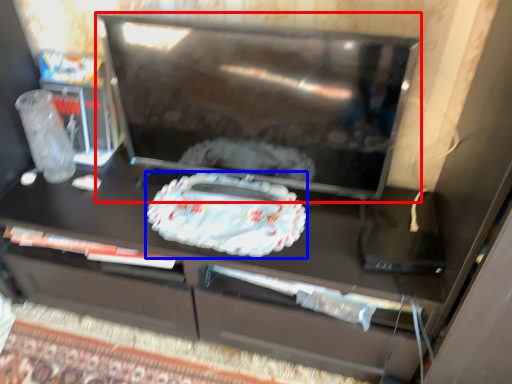
Question: Which of the following is the closest to the observer, appliance (highlighted by a red box) or food (highlighted by a blue box)?

Choices:
 (A) appliance
 (B) food

Answer: (A)